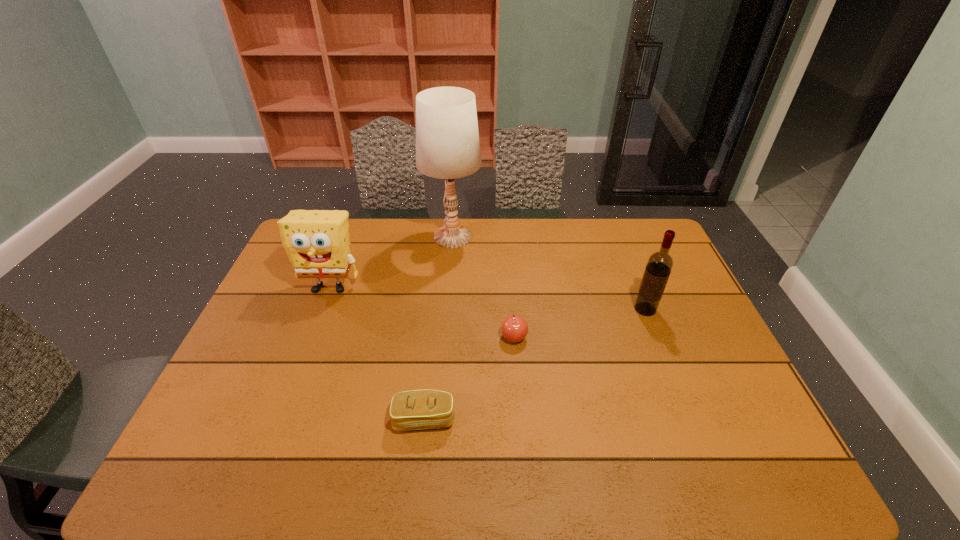
What are the coordinates of `empty space between the clutch bag and the wine bottle` in the screenshot? It's located at (535, 364).

At what (x,y) coordinates should I click in order to perform the action: click on the third closest object relative to the wine bottle. Please return your answer as a coordinate pair (x, y). Looking at the image, I should click on (417, 409).

I want to click on object that is the third nearest to the wine bottle, so click(x=417, y=409).

Identify the location of blank space that satisfies the following two spatial constraints: 1. on the face of the sponge; 2. on the left side of the rightmost object. This screenshot has width=960, height=540. (322, 309).

Locate an element on the screen. vacant position in the image that satisfies the following two spatial constraints: 1. on the face of the leftmost object; 2. on the left side of the second object from right to left is located at coordinates tap(311, 337).

Where is `vacant area that satisfies the following two spatial constraints: 1. on the face of the sponge; 2. on the left side of the wine bottle`? vacant area that satisfies the following two spatial constraints: 1. on the face of the sponge; 2. on the left side of the wine bottle is located at coordinates (322, 309).